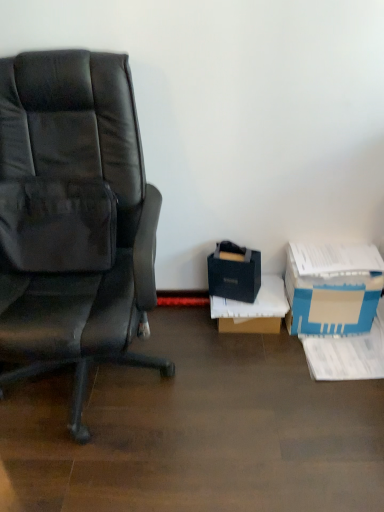
Question: Is matte black chair at left touching black matte box at lower right, which is the 2th box from left to right?

Choices:
 (A) no
 (B) yes

Answer: (A)

Question: Is matte black chair at left at the right side of black matte box at lower right, which is the 2th box from left to right?

Choices:
 (A) no
 (B) yes

Answer: (A)

Question: Does matte black chair at left have a lesser height compared to black matte box at lower right, acting as the 2th box starting from the right?

Choices:
 (A) yes
 (B) no

Answer: (B)

Question: Is the position of matte black chair at left more distant than that of black matte box at lower right, acting as the 2th box starting from the right?

Choices:
 (A) yes
 (B) no

Answer: (B)

Question: From the image's perspective, would you say matte black chair at left is shown under black matte box at lower right, acting as the 2th box starting from the right?

Choices:
 (A) no
 (B) yes

Answer: (A)

Question: Is matte black chair at left bigger than black matte box at lower right, which is the 2th box from left to right?

Choices:
 (A) yes
 (B) no

Answer: (A)

Question: Can you confirm if black matte bag at lower right, placed as the 1th box when sorted from left to right, is smaller than blue cardboard box at lower right, which is the 3th box in left-to-right order?

Choices:
 (A) no
 (B) yes

Answer: (B)

Question: Is black matte bag at lower right, the 3th box in the right-to-left sequence, in contact with blue cardboard box at lower right, the first box in the right-to-left sequence?

Choices:
 (A) yes
 (B) no

Answer: (B)

Question: Is black matte bag at lower right, the 3th box in the right-to-left sequence, wider than blue cardboard box at lower right, which is the 3th box in left-to-right order?

Choices:
 (A) yes
 (B) no

Answer: (B)

Question: Does black matte bag at lower right, the 3th box in the right-to-left sequence, have a lesser height compared to blue cardboard box at lower right, which is the 3th box in left-to-right order?

Choices:
 (A) yes
 (B) no

Answer: (A)

Question: From a real-world perspective, is black matte bag at lower right, placed as the 1th box when sorted from left to right, located higher than blue cardboard box at lower right, which is the 3th box in left-to-right order?

Choices:
 (A) yes
 (B) no

Answer: (A)

Question: Is black matte bag at lower right, placed as the 1th box when sorted from left to right, turned away from blue cardboard box at lower right, the first box in the right-to-left sequence?

Choices:
 (A) no
 (B) yes

Answer: (A)

Question: Is black matte bag at lower right, the 3th box in the right-to-left sequence, placed right next to black matte box at lower right, acting as the 2th box starting from the right?

Choices:
 (A) yes
 (B) no

Answer: (A)